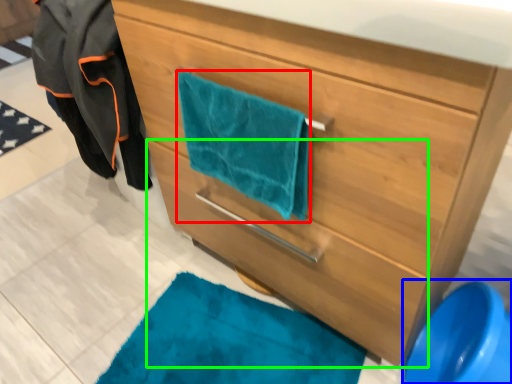
Question: Which is farther away from beach towel (highlighted by a red box)? teal (highlighted by a blue box) or drawer (highlighted by a green box)?

Choices:
 (A) teal
 (B) drawer

Answer: (A)